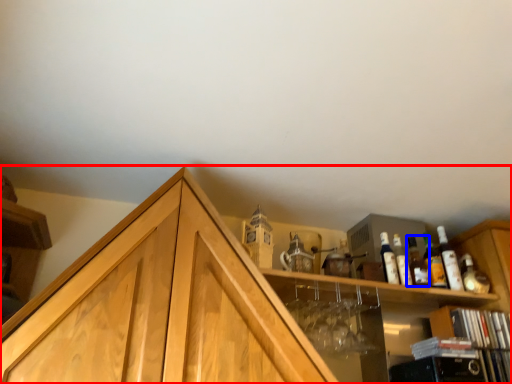
Question: Which object is closer to the camera taking this photo, cabinetry (highlighted by a red box) or bottle (highlighted by a blue box)?

Choices:
 (A) cabinetry
 (B) bottle

Answer: (A)